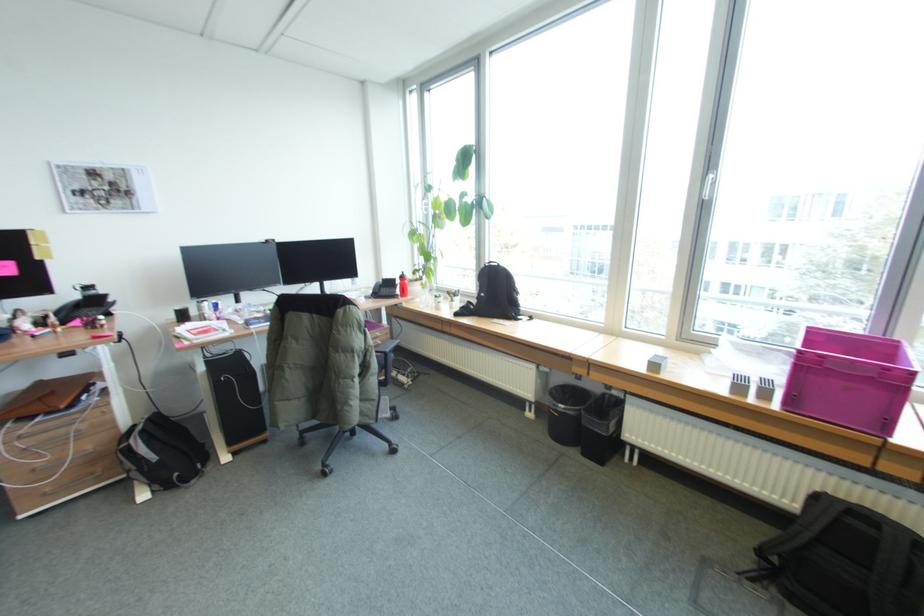
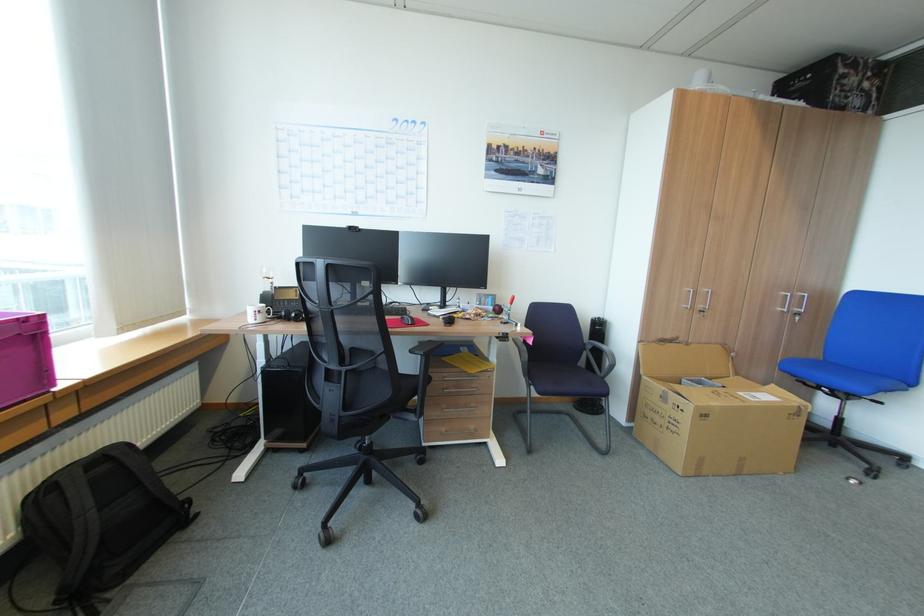
The point at (891, 367) is marked in the first image. Where is the corresponding point in the second image?

(29, 321)